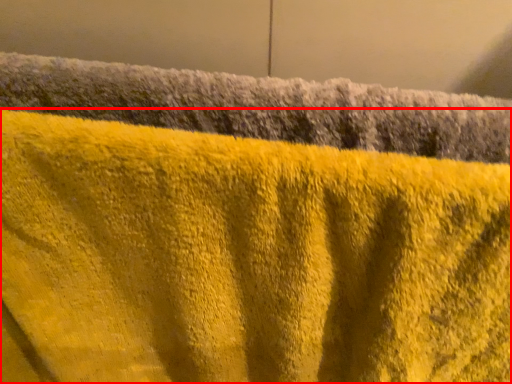
Question: From the image, what is the correct spatial relationship of towel (annotated by the red box) in relation to towel?

Choices:
 (A) left
 (B) right

Answer: (A)